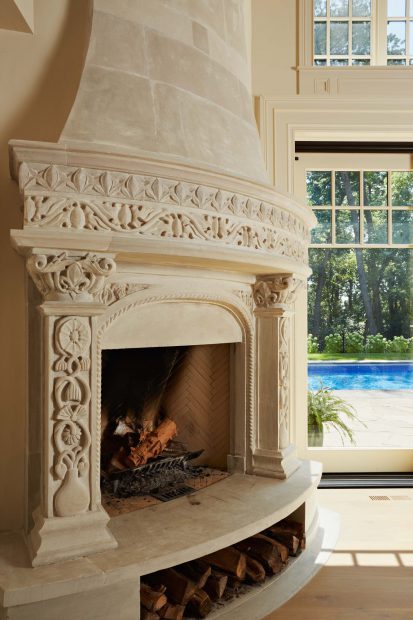
Where is `fireplace sidetrim with etching on it`? The width and height of the screenshot is (413, 620). fireplace sidetrim with etching on it is located at coordinates (75, 342), (72, 410), (74, 457), (284, 340), (285, 374), (286, 431).